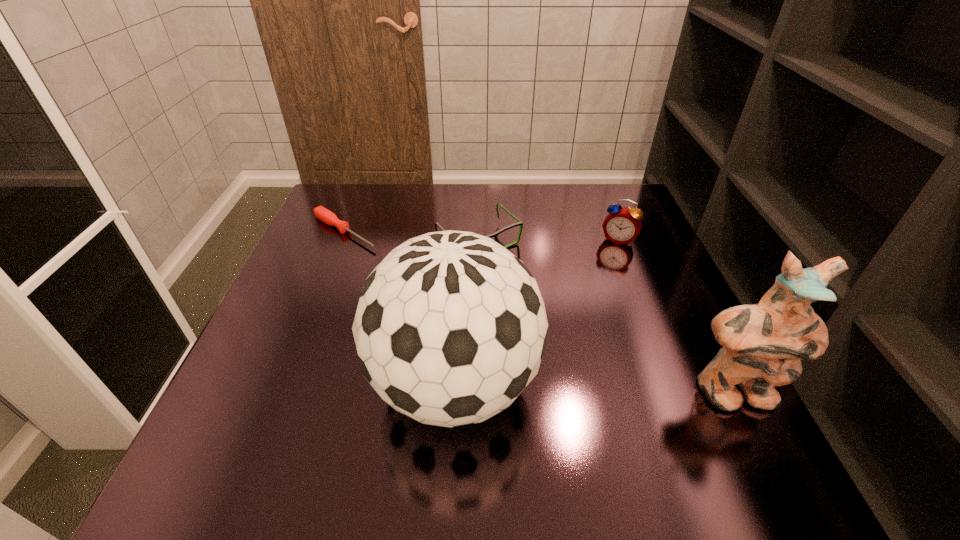
Identify the location of object at the left edge. This screenshot has width=960, height=540. (320, 212).

This screenshot has width=960, height=540. Identify the location of figurine at the right edge. (763, 344).

Where is `alarm clock at the right edge`? alarm clock at the right edge is located at coordinates (622, 225).

Where is `object present at the far left corner`? This screenshot has height=540, width=960. object present at the far left corner is located at coordinates (320, 212).

Locate an element on the screen. object located at the near right corner is located at coordinates (763, 344).

In the image, there is a desktop. Where is `vacant space at the far edge`? The height and width of the screenshot is (540, 960). vacant space at the far edge is located at coordinates (564, 216).

Identify the location of vacant area at the near edge of the desktop. (361, 394).

This screenshot has height=540, width=960. In the image, there is a desktop. In order to click on free space at the left edge in this screenshot , I will do `click(301, 311)`.

Where is `vacant space at the right edge of the desktop`? vacant space at the right edge of the desktop is located at coordinates (690, 306).

At what (x,y) coordinates should I click in order to perform the action: click on vacant region at the far left corner of the desktop. Please return your answer as a coordinate pair (x, y). This screenshot has height=540, width=960. Looking at the image, I should click on (357, 196).